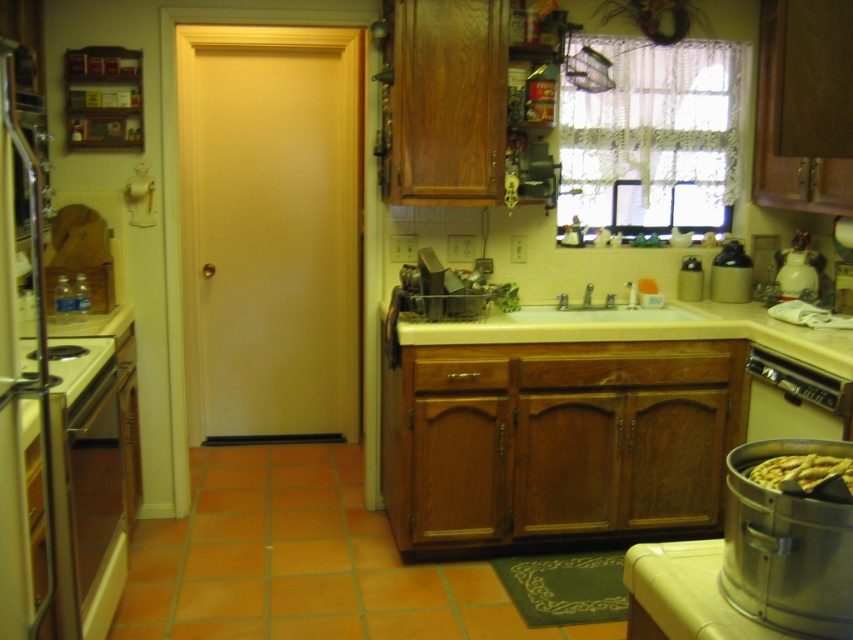
You are a kitchen designer planning to install a new faucet. You see the white marble sink at center and the yellow matte waffle at lower right. Which object is bigger and should be considered for faucet placement?

The white marble sink at center is larger in size than the yellow matte waffle at lower right, so the faucet should be placed on the white marble sink at center.